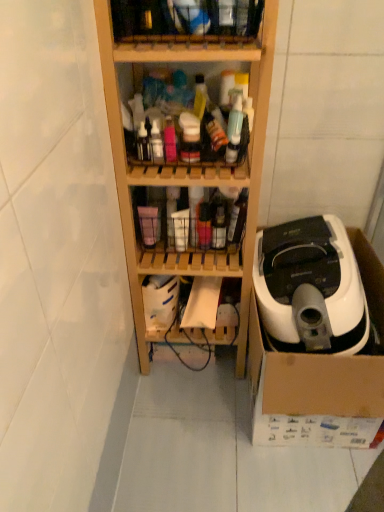
Question: In the image, is translucent plastic bottles at center, which is counted as the 1th shelf, starting from the bottom, positioned in front of or behind white plastic vacuum cleaner at right?

Choices:
 (A) behind
 (B) front

Answer: (A)

Question: Do you think translucent plastic bottles at center, which is counted as the 1th shelf, starting from the bottom, is within white plastic vacuum cleaner at right, or outside of it?

Choices:
 (A) inside
 (B) outside

Answer: (B)

Question: Estimate the real-world distances between objects in this image. Which object is closer to the wooden shelf at center, positioned as the second shelf in bottom-to-top order?

Choices:
 (A) black rubber wire at lower center
 (B) translucent plastic bottles at center, which is counted as the 3th shelf, starting from the bottom
 (C) translucent plastic bottles at center, acting as the 4th shelf starting from the top
 (D) wooden shelf at upper center, which is the fourth shelf in bottom-to-top order
 (E) white plastic vacuum cleaner at right

Answer: (B)

Question: Which of these objects is positioned farthest from the translucent plastic bottles at center, which is counted as the 3th shelf, starting from the bottom?

Choices:
 (A) wooden shelf at upper center, which is the fourth shelf in bottom-to-top order
 (B) white plastic vacuum cleaner at right
 (C) translucent plastic bottles at center, which is counted as the 1th shelf, starting from the bottom
 (D) black rubber wire at lower center
 (E) wooden shelf at center, positioned as the second shelf in bottom-to-top order

Answer: (D)